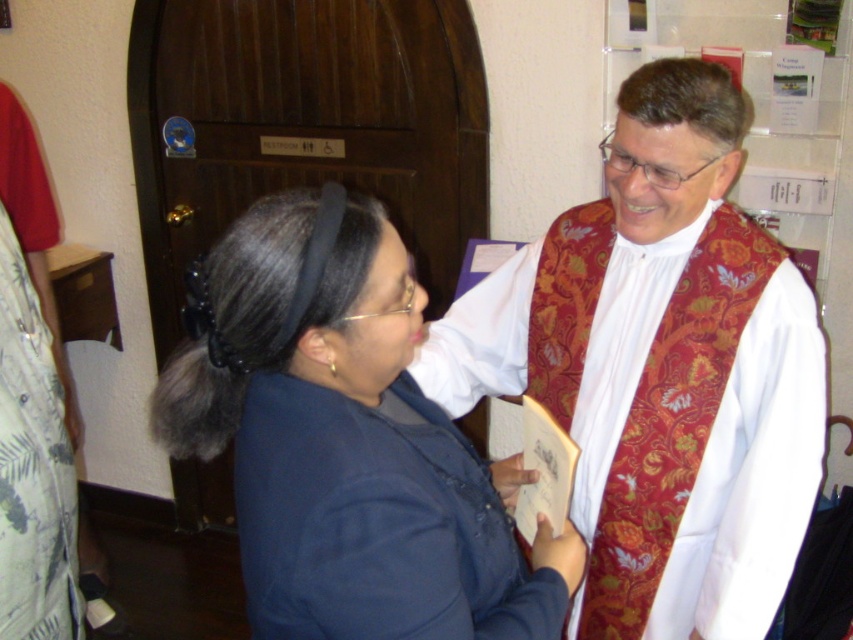
Is the position of matte red vest at center more distant than that of printed cotton robe at left?

No, it is not.

Does matte red vest at center appear on the left side of printed cotton robe at left?

No, matte red vest at center is not to the left of printed cotton robe at left.

Identify the location of matte red vest at center. (660, 371).

This screenshot has height=640, width=853. I want to click on matte red vest at center, so click(660, 371).

Which is in front, point (392, 272) or point (28, 369)?

Positioned in front is point (392, 272).

Who is positioned more to the left, dark blue fabric at center or printed cotton robe at left?

From the viewer's perspective, printed cotton robe at left appears more on the left side.

Between point (405, 592) and point (55, 528), which one is positioned in front?

Point (405, 592) is more forward.

Locate an element on the screen. The height and width of the screenshot is (640, 853). dark blue fabric at center is located at coordinates (347, 440).

Is matte red vest at center shorter than dark blue fabric at center?

No.

Can you confirm if matte red vest at center is thinner than dark blue fabric at center?

In fact, matte red vest at center might be wider than dark blue fabric at center.

Does point (506, 394) come in front of point (247, 298)?

No, it is behind (247, 298).

This screenshot has height=640, width=853. I want to click on matte red vest at center, so click(x=660, y=371).